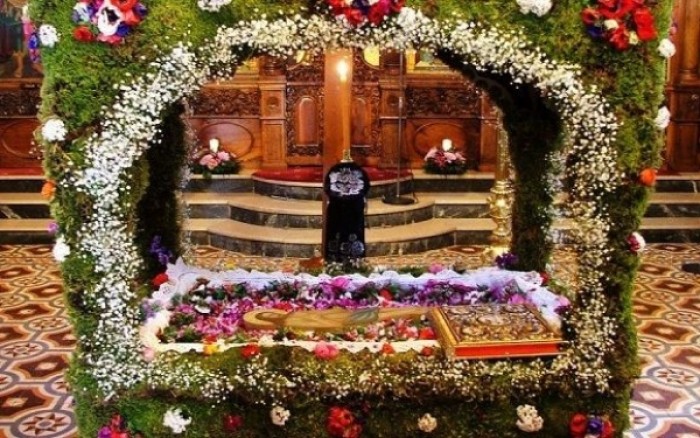
Where is `lit candles`? This screenshot has width=700, height=438. lit candles is located at coordinates (213, 147), (441, 151).